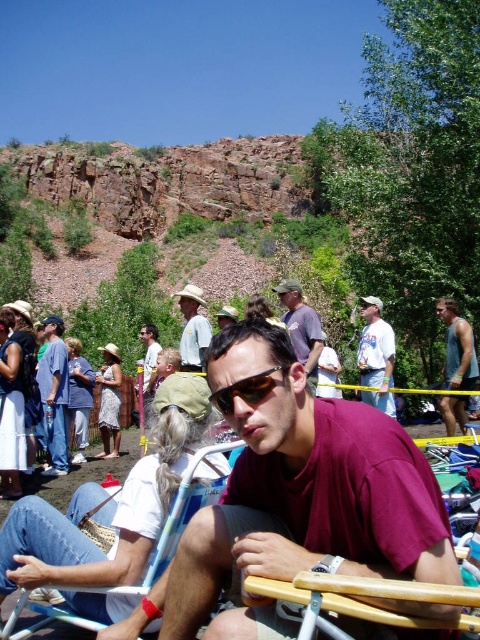
You are standing at the center of the image and want to place a small object exactly where the matte blue jeans at center are located. What coordinates should you use?

The coordinates for the matte blue jeans at center are at point [54,394].

You are standing at the center of the image and see a point marked at coordinates (375, 356). Which object is located at that point?

The point at coordinates (375, 356) indicates the white cotton shirt at center.

You are planning to take a photo of the people in the scene. Which object, the white cotton shirt at center or the matte brown hat at center, should you focus on first if you want to capture the one that is lower in the frame?

The white cotton shirt at center is below the matte brown hat at center, so you should focus on the white cotton shirt at center first if you want to capture the one that is lower in the frame.